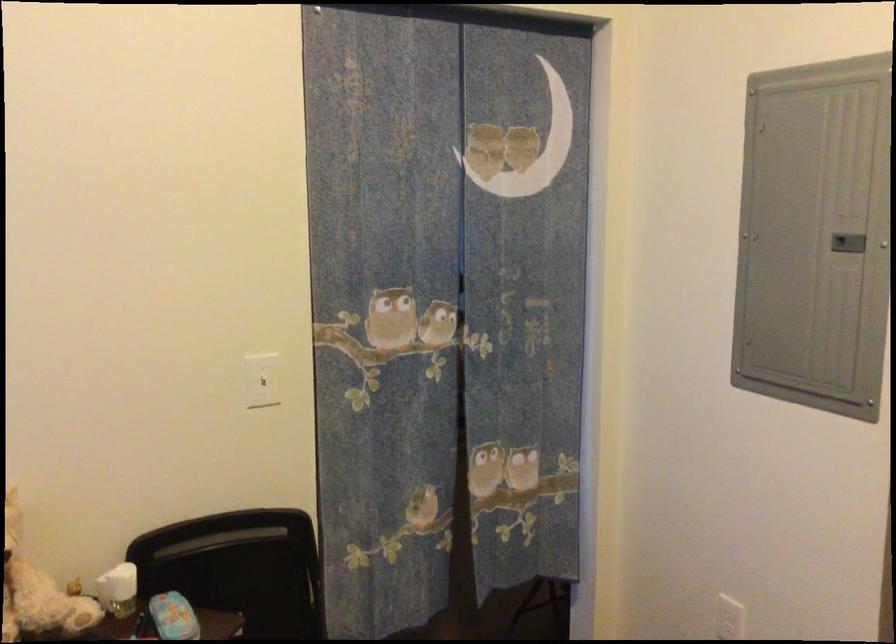
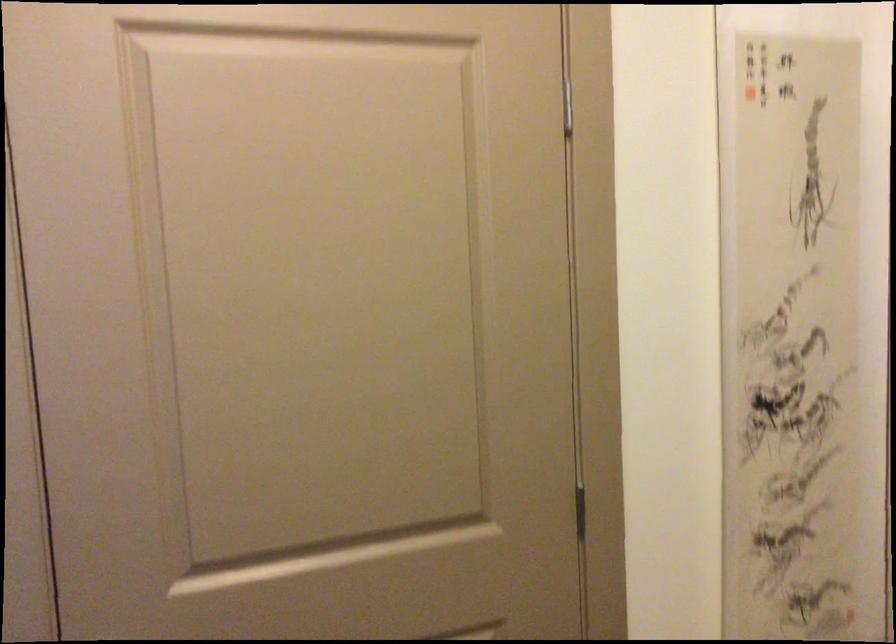
Question: Based on the continuous images, in which direction is the camera rotating? Reply with the corresponding letter.

Choices:
 (A) Left
 (B) Right
 (C) Up
 (D) Down

Answer: (B)